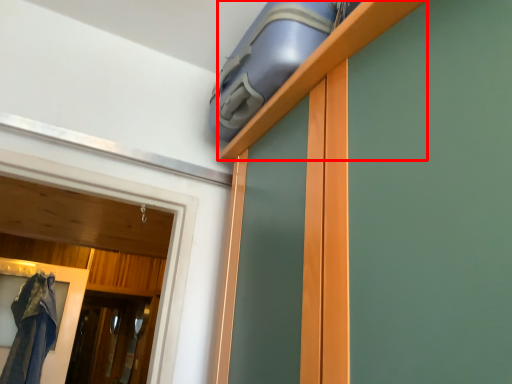
Question: From the image's perspective, where is shelf (annotated by the red box) located relative to screen door?

Choices:
 (A) above
 (B) below

Answer: (A)